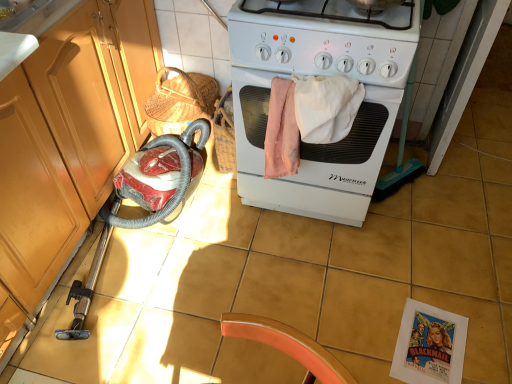
Locate an element on the screen. This screenshot has width=512, height=384. white glossy gas stove at center is located at coordinates (324, 39).

This screenshot has width=512, height=384. What do you see at coordinates (324, 39) in the screenshot?
I see `white glossy gas stove at center` at bounding box center [324, 39].

This screenshot has height=384, width=512. Describe the element at coordinates (70, 133) in the screenshot. I see `matte wood cabinet at left` at that location.

This screenshot has width=512, height=384. What do you see at coordinates (317, 74) in the screenshot?
I see `white matte stove at center` at bounding box center [317, 74].

Image resolution: width=512 pixels, height=384 pixels. In order to click on white glossy gas stove at center in this screenshot , I will do `click(324, 39)`.

Between white matte stove at center and matte wood cabinet at left, which one appears on the left side from the viewer's perspective?

matte wood cabinet at left.

Would you say white matte stove at center is outside matte wood cabinet at left?

Indeed, white matte stove at center is completely outside matte wood cabinet at left.

Is matte wood cabinet at left far from white matte stove at center?

matte wood cabinet at left is near white matte stove at center, not far away.

Could you tell me if matte wood cabinet at left is turned towards white matte stove at center?

No, matte wood cabinet at left is not aimed at white matte stove at center.

Considering the sizes of matte wood cabinet at left and white matte stove at center in the image, is matte wood cabinet at left taller or shorter than white matte stove at center?

Considering their sizes, matte wood cabinet at left has less height than white matte stove at center.

Who is bigger, matte wood cabinet at left or white matte stove at center?

With larger size is white matte stove at center.

Locate an element on the screen. gas stove in front of the matte wood cabinet at left is located at coordinates pos(324,39).

Is matte wood cabinet at left aimed at white glossy gas stove at center?

No, matte wood cabinet at left is not facing towards white glossy gas stove at center.

Between matte wood cabinet at left and white glossy gas stove at center, which one has larger size?

matte wood cabinet at left.

Does white glossy gas stove at center have a lesser width compared to white matte stove at center?

Yes.

Is the depth of white glossy gas stove at center greater than that of white matte stove at center?

No, the depth of white glossy gas stove at center is less than that of white matte stove at center.

Does white glossy gas stove at center touch white matte stove at center?

white glossy gas stove at center and white matte stove at center are clearly separated.

From a real-world perspective, is white matte stove at center on white glossy gas stove at center?

Incorrect, from a real-world perspective, white matte stove at center is lower than white glossy gas stove at center.

From the image's perspective, is white matte stove at center above white glossy gas stove at center?

No, from the image's perspective, white matte stove at center is not on top of white glossy gas stove at center.

Is there a large distance between white matte stove at center and white glossy gas stove at center?

No.

Is white matte stove at center positioned beyond the bounds of white glossy gas stove at center?

Absolutely, white matte stove at center is external to white glossy gas stove at center.

Would you consider white glossy gas stove at center to be distant from matte wood cabinet at left?

→ No, white glossy gas stove at center is not far away from matte wood cabinet at left.

Is the position of white glossy gas stove at center more distant than that of matte wood cabinet at left?

That is False.

This screenshot has width=512, height=384. In order to click on gas stove in front of the matte wood cabinet at left in this screenshot , I will do point(324,39).

Image resolution: width=512 pixels, height=384 pixels. I want to click on home appliance that is behind the matte wood cabinet at left, so click(317, 74).

What are the coordinates of `home appliance on the right of the matte wood cabinet at left` in the screenshot? It's located at (317, 74).

Which object lies further to the anchor point white glossy gas stove at center, white matte stove at center or matte wood cabinet at left?

matte wood cabinet at left is further to white glossy gas stove at center.

From the image, which object appears to be farther from white glossy gas stove at center, matte wood cabinet at left or white matte stove at center?

matte wood cabinet at left is further to white glossy gas stove at center.

Based on the photo, looking at the image, which one is located further to matte wood cabinet at left, white matte stove at center or white glossy gas stove at center?

white glossy gas stove at center lies further to matte wood cabinet at left than the other object.

Considering their positions, is matte wood cabinet at left positioned closer to white matte stove at center than white glossy gas stove at center?

white glossy gas stove at center is closer to white matte stove at center.

Based on their spatial positions, is white glossy gas stove at center or matte wood cabinet at left closer to white matte stove at center?

white glossy gas stove at center lies closer to white matte stove at center than the other object.

When comparing their distances from matte wood cabinet at left, does white glossy gas stove at center or white matte stove at center seem further?

Based on the image, white glossy gas stove at center appears to be further to matte wood cabinet at left.

Identify the location of gas stove between matte wood cabinet at left and white matte stove at center. The image size is (512, 384). pos(324,39).